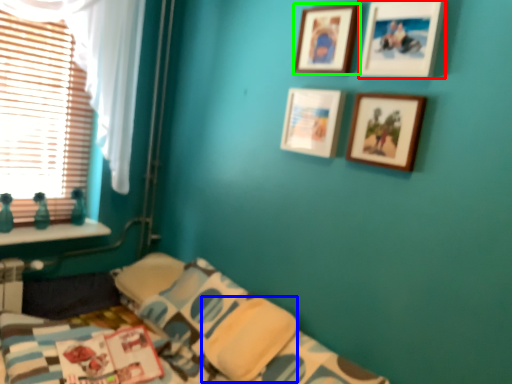
Question: Considering the real-world distances, which object is farthest from picture frame (highlighted by a red box)? pillow (highlighted by a blue box) or picture frame (highlighted by a green box)?

Choices:
 (A) pillow
 (B) picture frame

Answer: (A)